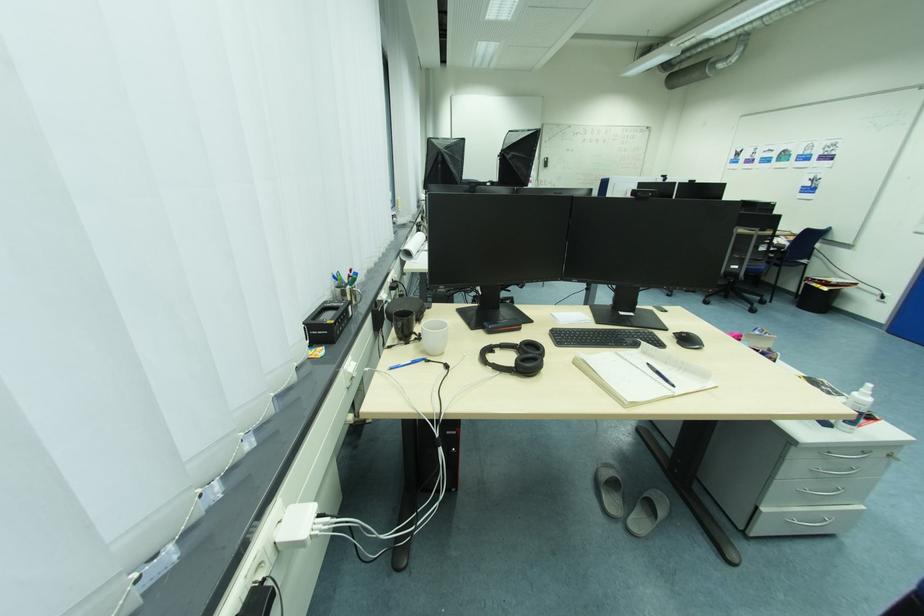
Find where to lift the open spiral notebook. Please return your answer as a coordinate pair (x, y).

(642, 374)